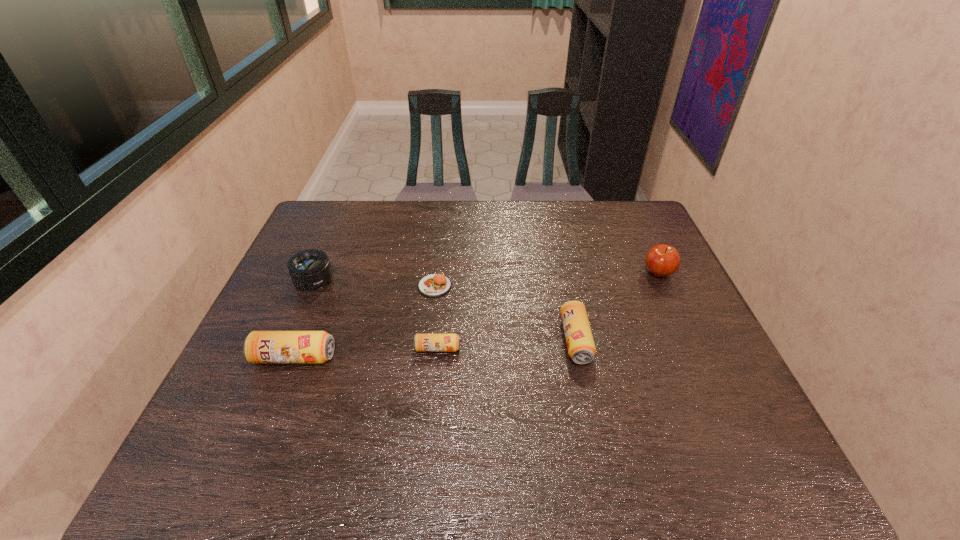
Locate an element on the screen. the leftmost beer can is located at coordinates (259, 346).

In order to click on the fifth tallest object in this screenshot , I will do `click(422, 342)`.

The image size is (960, 540). In order to click on the shortest beer can in this screenshot , I will do `click(422, 342)`.

You are a GUI agent. You are given a task and a screenshot of the screen. Output one action in this format:
    pyautogui.click(x=<x>, y=<y>)
    Task: Click on the rightmost beer can
    
    Given the screenshot: What is the action you would take?
    pyautogui.click(x=581, y=349)

Locate an element on the screen. The image size is (960, 540). the second shortest beer can is located at coordinates (581, 349).

Where is `the shortest object`? the shortest object is located at coordinates (433, 285).

Locate an element on the screen. telephoto lens is located at coordinates (309, 270).

Find the location of a particular element. the tallest object is located at coordinates (662, 260).

Where is `the rightmost object`? The width and height of the screenshot is (960, 540). the rightmost object is located at coordinates (662, 260).

Where is `vacant area situated on the back of the leftmost beer can`? vacant area situated on the back of the leftmost beer can is located at coordinates (331, 264).